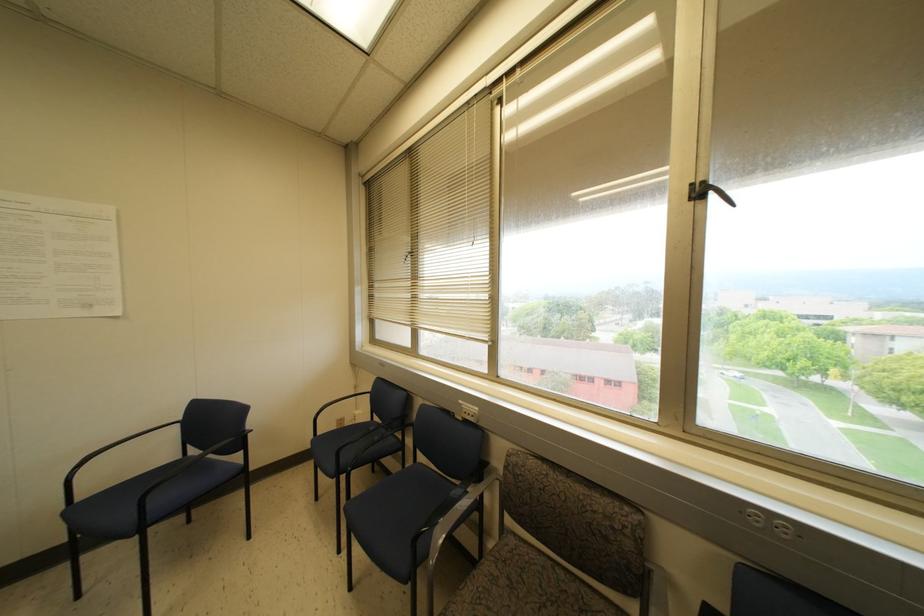
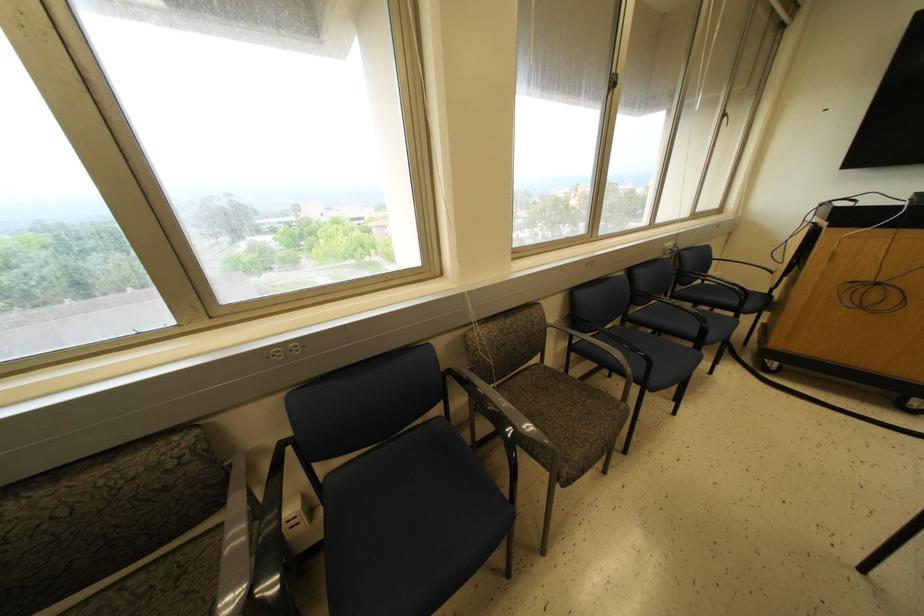
How did the camera likely rotate?

The camera's rotation is toward right-down.